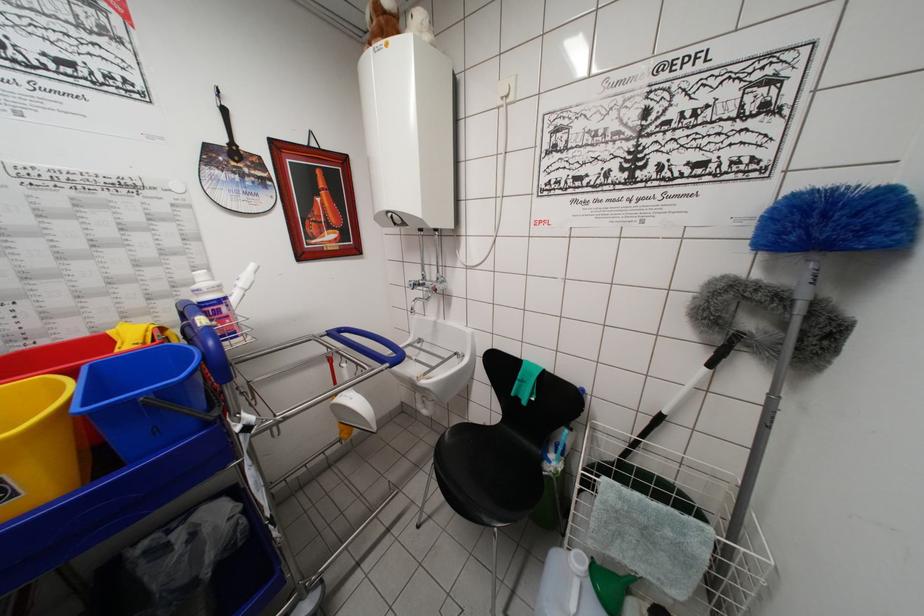
Which object does [565,586] point to?

It refers to a white plastic jug.